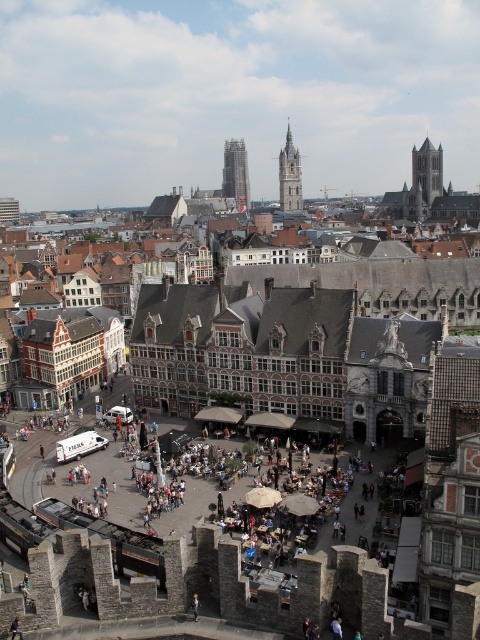
Question: Which object appears farthest from the camera in this image?

Choices:
 (A) glassy steel skyscraper at center
 (B) gray stone tower at upper right

Answer: (A)

Question: Which point is farther from the camera taking this photo?

Choices:
 (A) (417, 152)
 (B) (244, 180)
 (C) (288, 163)

Answer: (B)

Question: Which point is farther to the camera?

Choices:
 (A) (283, 163)
 (B) (420, 161)
 (C) (231, 147)

Answer: (C)

Question: Can you confirm if glassy steel skyscraper at center is positioned to the right of gray stone clock tower at center?

Choices:
 (A) yes
 (B) no

Answer: (B)

Question: Can you confirm if gray stone tower at upper right is smaller than gray stone clock tower at center?

Choices:
 (A) yes
 (B) no

Answer: (A)

Question: Can you confirm if glassy steel skyscraper at center is positioned above gray stone clock tower at center?

Choices:
 (A) yes
 (B) no

Answer: (A)